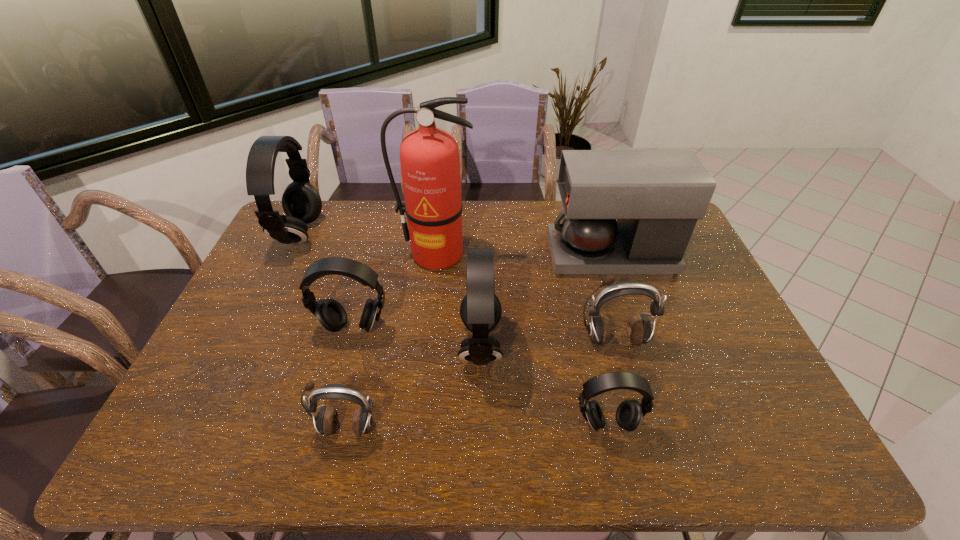
The height and width of the screenshot is (540, 960). I want to click on free space located 0.160m on the ear cups of the fifth shortest earphone, so click(x=400, y=345).

Locate an element on the screen. This screenshot has width=960, height=540. blank area located on the ear cups of the fifth shortest earphone is located at coordinates (327, 345).

Identify the location of free space located 0.280m on the ear cups of the second black earphone from left to right. The height and width of the screenshot is (540, 960). [x=323, y=435].

Find the location of a particular element. blank space located on the ear pads of the right brown earphone is located at coordinates (633, 406).

Where is `free region located on the ear pads of the left brown earphone`? The image size is (960, 540). free region located on the ear pads of the left brown earphone is located at coordinates (337, 463).

Where is `fire extinguisher that is at the far edge`? fire extinguisher that is at the far edge is located at coordinates (429, 157).

Where is `earphone positioned at the far edge`? This screenshot has height=540, width=960. earphone positioned at the far edge is located at coordinates (301, 202).

The width and height of the screenshot is (960, 540). I want to click on coffee maker positioned at the far edge, so click(657, 196).

Identify the location of object at the left edge. The image size is (960, 540). (301, 202).

The width and height of the screenshot is (960, 540). Find the location of `object at the right edge`. object at the right edge is located at coordinates (657, 196).